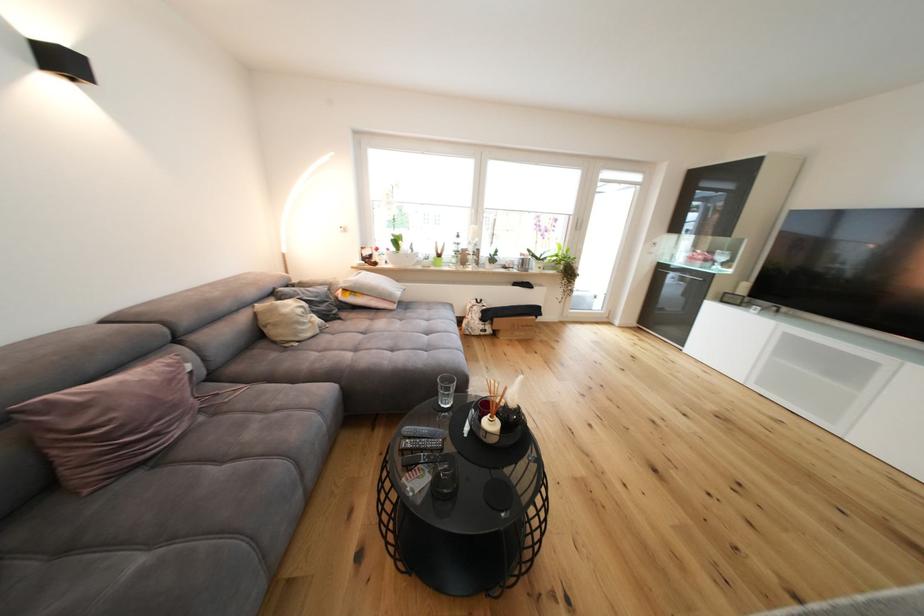
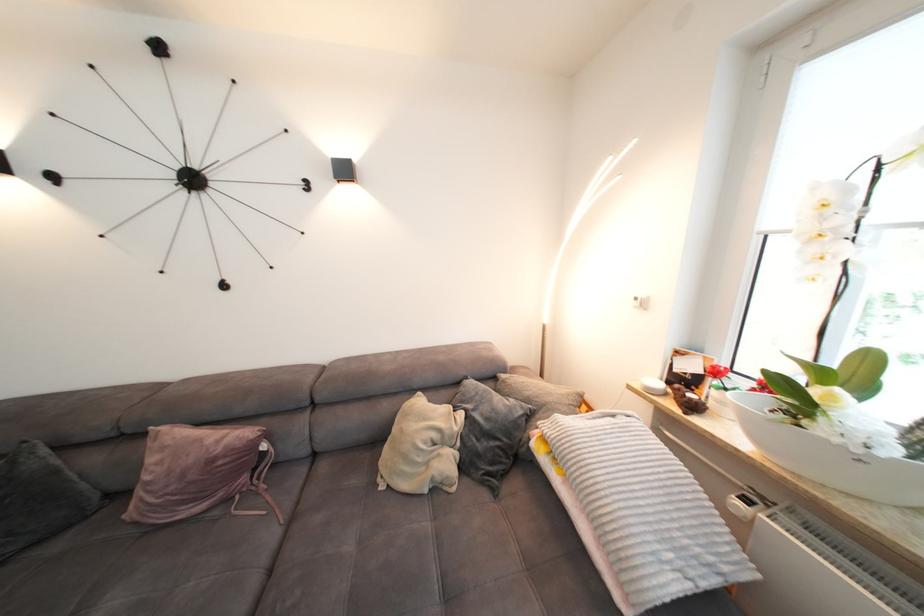
Find the pixel in the second image that matches pixel 88 408 in the first image.

(171, 448)